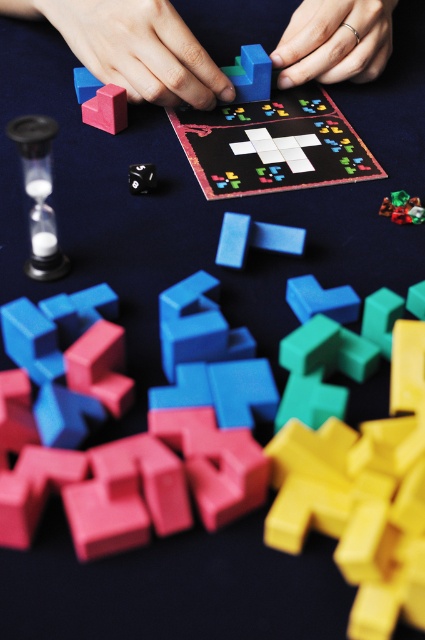
You are a game designer trying to create a new level for a Tetris game. You need to place the rubberized matte cube at upper left and the matte black die at center on the game board. What is the minimum distance you need to maintain between them to ensure they donot overlap?

The rubberized matte cube at upper left is 11.73 centimeters away from the matte black die at center, so the minimum distance to maintain between them is 11.73 centimeters to prevent overlapping.

You are a game designer analyzing the Tetris game setup. You notice the silver metallic ring at upper center and the rubberized green cube at center. Which object is taller in the image?

The silver metallic ring at upper center is taller than the rubberized green cube at center.